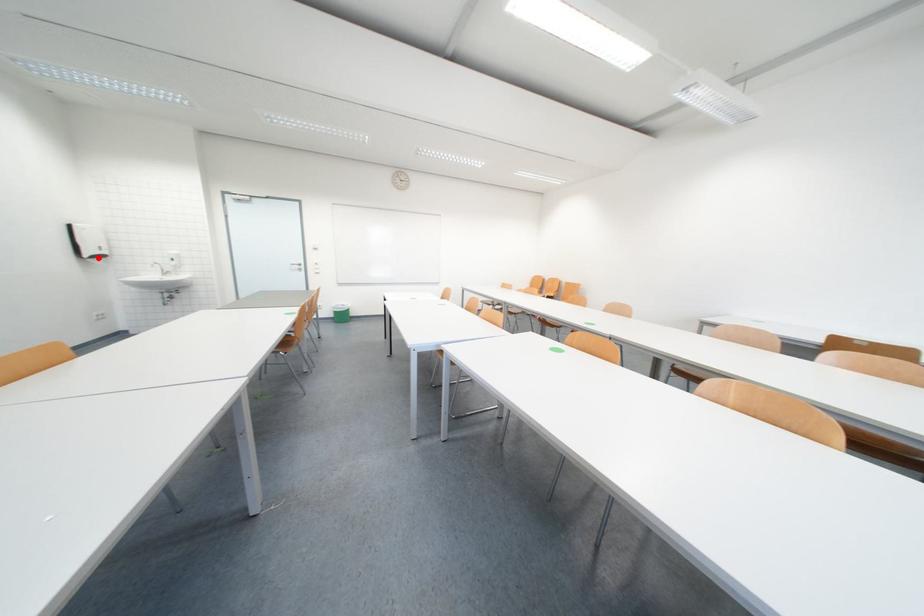
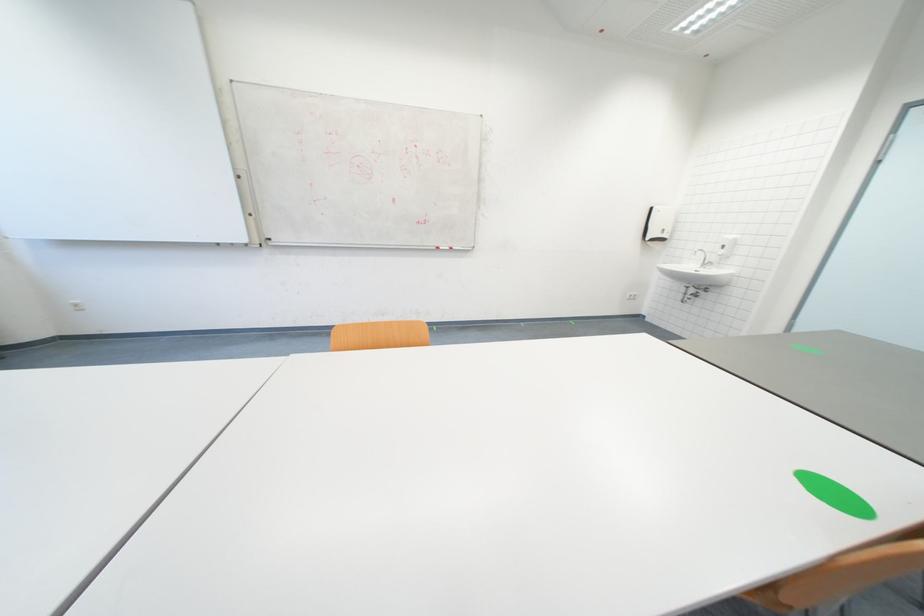
Where in the second image is the point corresponding to the highlighted location from the first image?

(657, 241)